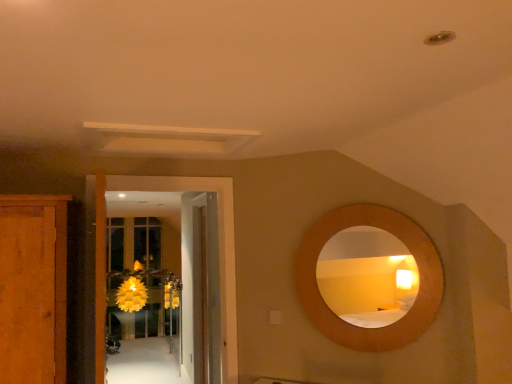
Question: From a real-world perspective, is yellow paper flower at center under wooden door at center, arranged as the 2th door when viewed from the front?

Choices:
 (A) yes
 (B) no

Answer: (A)

Question: Is yellow paper flower at center surrounding wooden door at center, the first door positioned from the back?

Choices:
 (A) no
 (B) yes

Answer: (A)

Question: Is yellow paper flower at center oriented away from wooden door at center, arranged as the 2th door when viewed from the front?

Choices:
 (A) no
 (B) yes

Answer: (A)

Question: From a real-world perspective, is yellow paper flower at center physically above wooden door at center, the first door positioned from the back?

Choices:
 (A) no
 (B) yes

Answer: (A)

Question: Does yellow paper flower at center have a greater width compared to wooden door at center, arranged as the 2th door when viewed from the front?

Choices:
 (A) no
 (B) yes

Answer: (B)

Question: Does point (134, 304) appear closer or farther from the camera than point (204, 299)?

Choices:
 (A) farther
 (B) closer

Answer: (A)

Question: Looking at their shapes, would you say yellow paper flower at center is wider or thinner than wooden door at center, the first door positioned from the back?

Choices:
 (A) thin
 (B) wide

Answer: (B)

Question: In terms of height, does yellow paper flower at center look taller or shorter compared to wooden door at center, arranged as the 2th door when viewed from the front?

Choices:
 (A) tall
 (B) short

Answer: (B)

Question: From the image's perspective, relative to wooden door at center, the first door positioned from the back, is yellow paper flower at center above or below?

Choices:
 (A) below
 (B) above

Answer: (A)

Question: In terms of height, does translucent yellow glass door at center look taller or shorter compared to wooden circular mirror at upper right?

Choices:
 (A) tall
 (B) short

Answer: (A)

Question: Is point (141, 254) closer or farther from the camera than point (313, 256)?

Choices:
 (A) farther
 (B) closer

Answer: (A)

Question: Relative to wooden circular mirror at upper right, is translucent yellow glass door at center in front or behind?

Choices:
 (A) front
 (B) behind

Answer: (B)

Question: From a real-world perspective, relative to wooden circular mirror at upper right, is translucent yellow glass door at center vertically above or below?

Choices:
 (A) above
 (B) below

Answer: (B)

Question: Considering the positions of point (118, 291) and point (96, 359), is point (118, 291) closer or farther from the camera than point (96, 359)?

Choices:
 (A) farther
 (B) closer

Answer: (A)

Question: Considering their positions, is yellow paper flower at center located in front of or behind white glossy door at center, the second door positioned from the back?

Choices:
 (A) behind
 (B) front

Answer: (A)